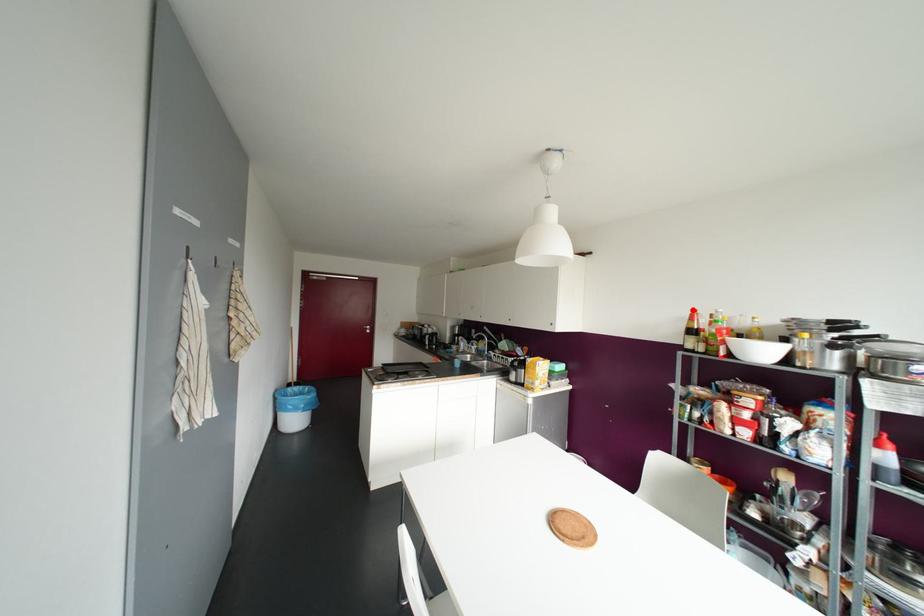
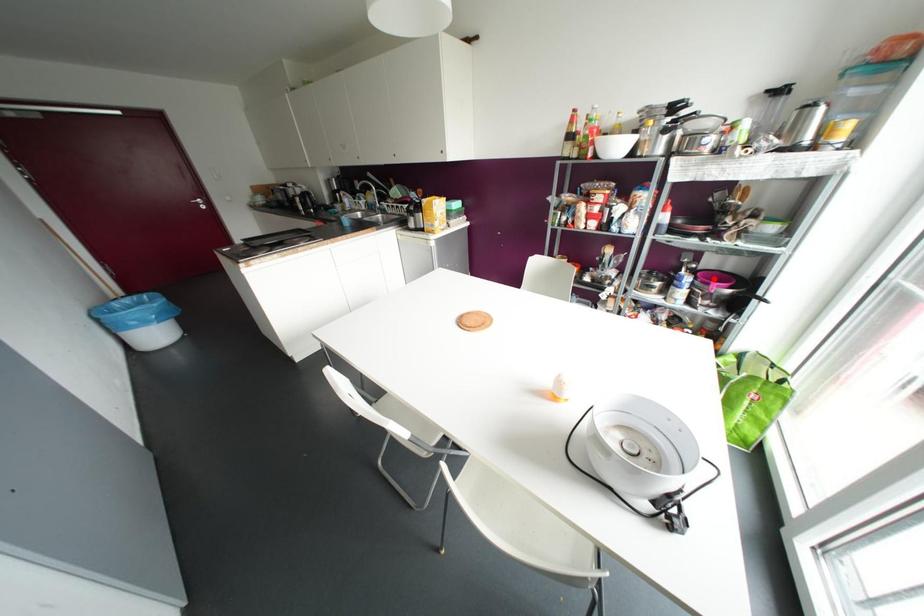
I am providing you with two images of the same scene from different viewpoints. A red point is marked on the first image and another point is marked on the second image. Does the point marked in image1 correspond to the same location as the one in image2?

No